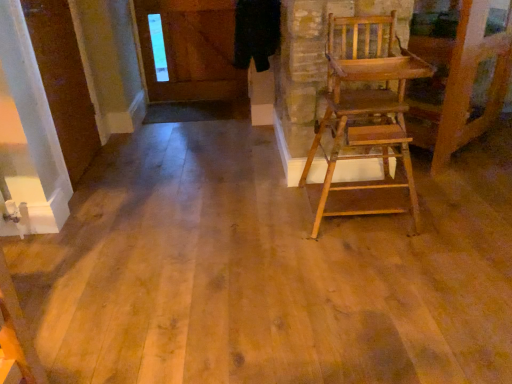
At what (x,y) coordinates should I click in order to perform the action: click on vacant area that lies to the right of wooden high chair at right. Please return your answer as a coordinate pair (x, y). This screenshot has width=512, height=384. Looking at the image, I should click on (459, 212).